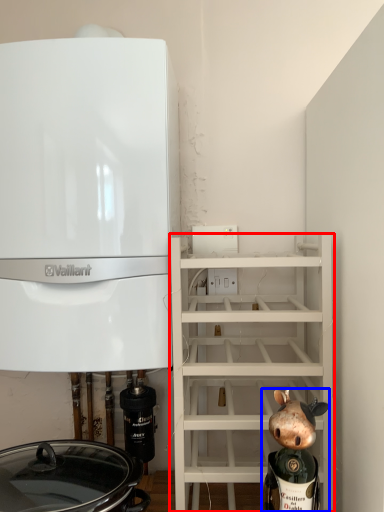
Question: Which object is closer to the camera taking this photo, shelf (highlighted by a red box) or figurine (highlighted by a blue box)?

Choices:
 (A) shelf
 (B) figurine

Answer: (B)